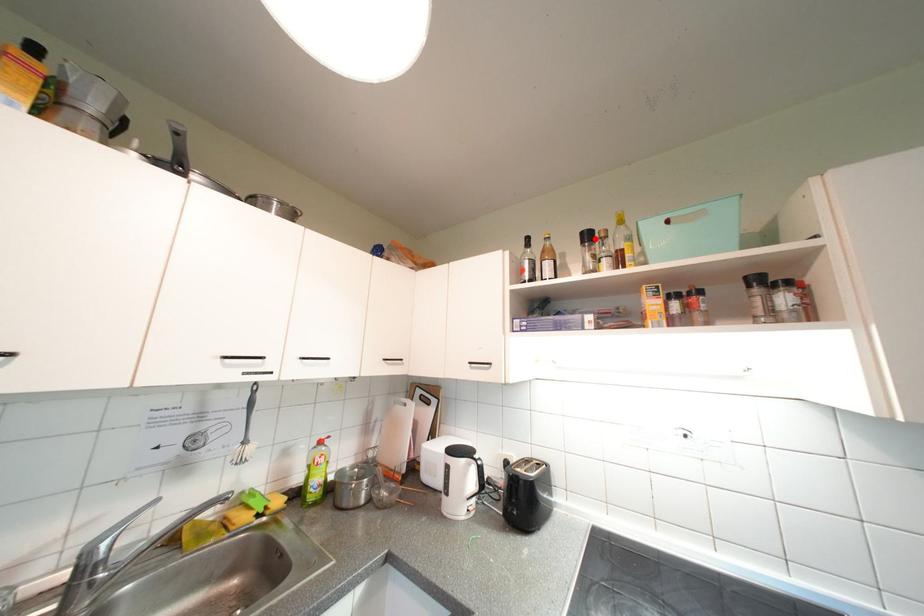
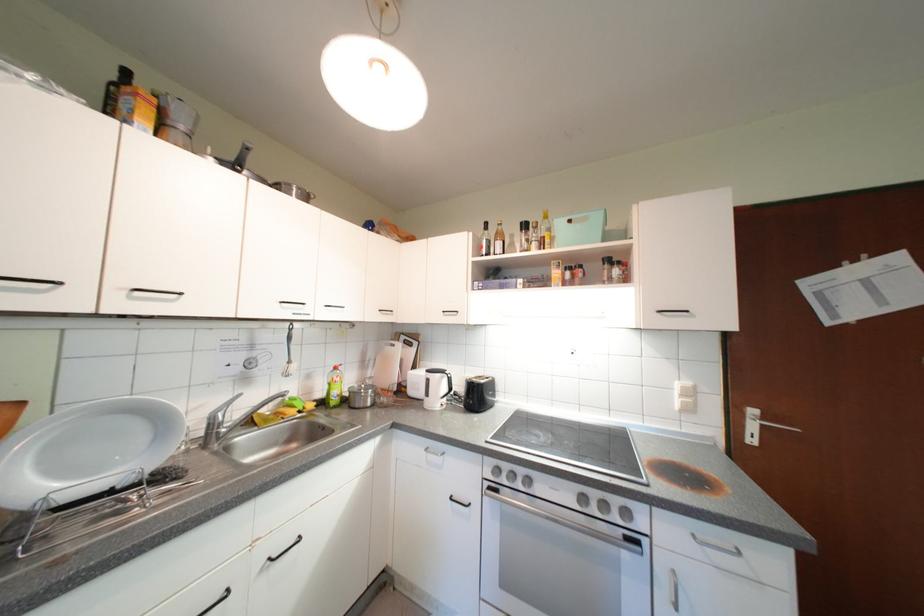
Where in the second image is the point corresponding to the highlighted location from the first image?

(532, 228)